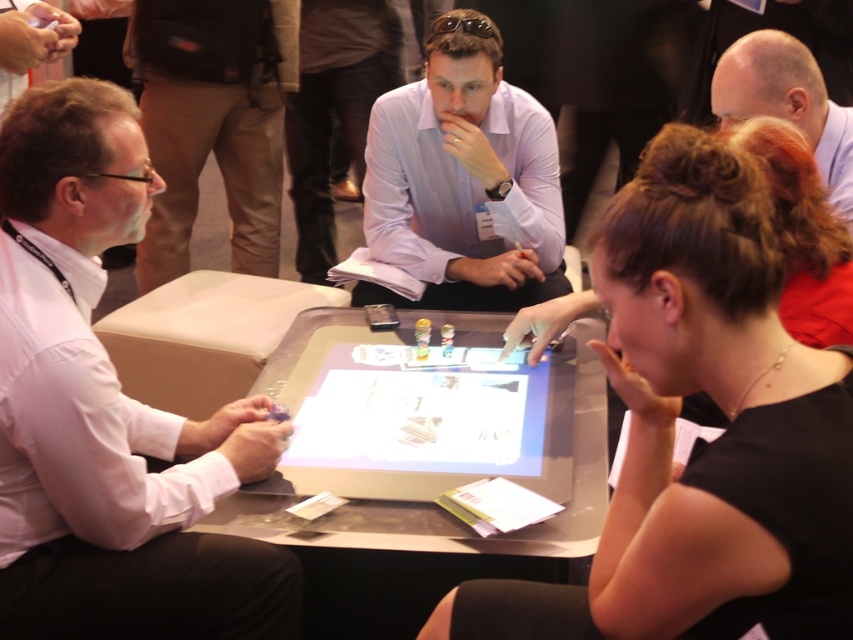
Question: Can you confirm if black matte hair at center is wider than transparent glass table at center?

Choices:
 (A) yes
 (B) no

Answer: (B)

Question: Can you confirm if light purple shirt at center is wider than transparent glass table at center?

Choices:
 (A) yes
 (B) no

Answer: (B)

Question: Estimate the real-world distances between objects in this image. Which object is closer to the bald head at upper right?

Choices:
 (A) black matte hair at center
 (B) transparent glass table at center
 (C) light purple shirt at center

Answer: (C)

Question: Does white glossy shirt at left come behind bald head at upper right?

Choices:
 (A) yes
 (B) no

Answer: (B)

Question: Estimate the real-world distances between objects in this image. Which object is farther from the bald head at upper right?

Choices:
 (A) light purple shirt at center
 (B) white glossy shirt at left

Answer: (B)

Question: Which of the following is the closest to the observer?

Choices:
 (A) light purple shirt at center
 (B) black matte hair at center
 (C) transparent glass table at center
 (D) white glossy shirt at left

Answer: (B)